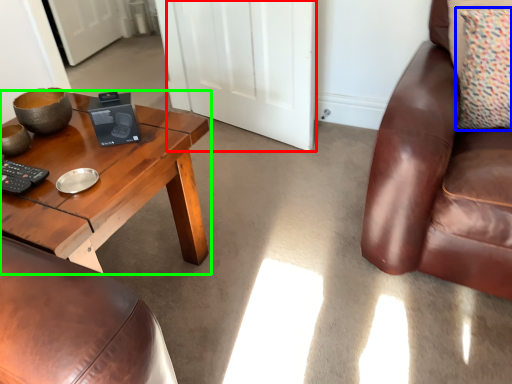
Question: Which is nearer to the door (highlighted by a red box)? pillow (highlighted by a blue box) or coffee table (highlighted by a green box).

Choices:
 (A) pillow
 (B) coffee table

Answer: (B)